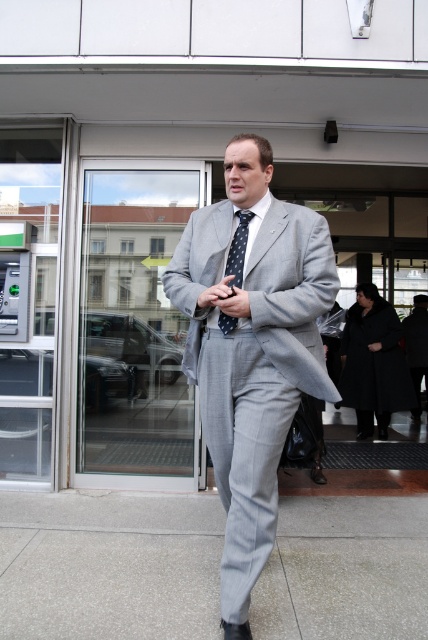
Question: Which object is the closest to the black wool coat at lower right?

Choices:
 (A) polka dot silk tie at center
 (B) gray concrete pavement at lower center

Answer: (B)

Question: Is gray concrete pavement at lower center closer to camera compared to gray pinstripe suit at center?

Choices:
 (A) no
 (B) yes

Answer: (A)

Question: Which point is closer to the camera?

Choices:
 (A) gray pinstripe suit at center
 (B) polka dot silk tie at center
 (C) gray concrete pavement at lower center
 (D) black wool coat at lower right

Answer: (A)

Question: Is gray pinstripe suit at center thinner than black wool coat at lower right?

Choices:
 (A) yes
 (B) no

Answer: (A)

Question: Is gray pinstripe suit at center smaller than black wool coat at lower right?

Choices:
 (A) yes
 (B) no

Answer: (A)

Question: Which object appears farthest from the camera in this image?

Choices:
 (A) polka dot silk tie at center
 (B) gray pinstripe suit at center
 (C) gray concrete pavement at lower center
 (D) black wool coat at lower right

Answer: (D)